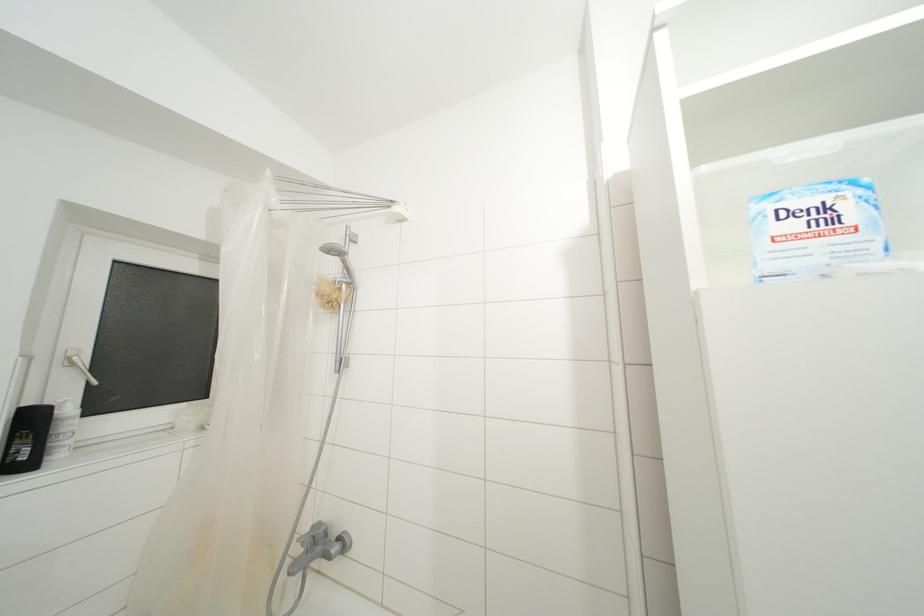
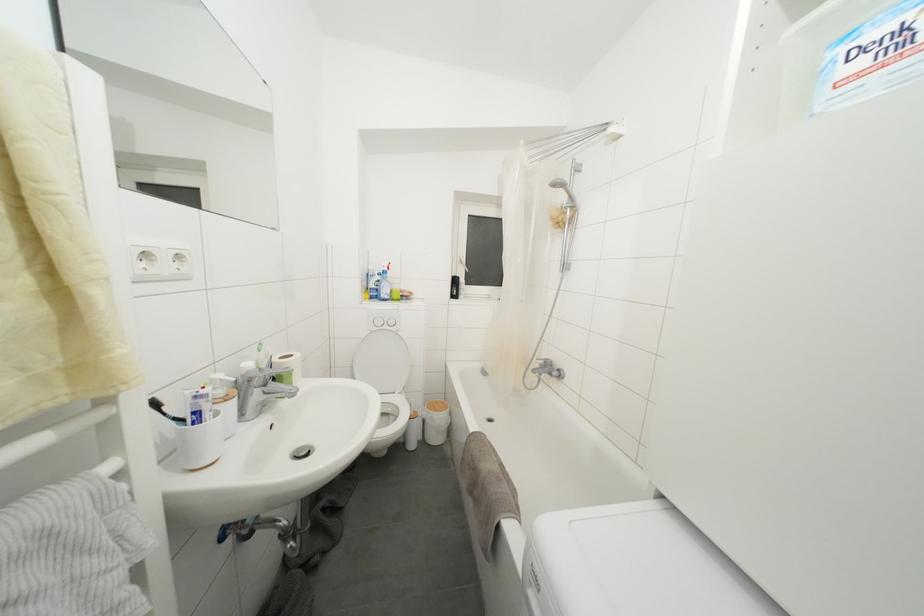
Question: How did the camera likely rotate?

Choices:
 (A) Left
 (B) Right
 (C) Up
 (D) Down

Answer: (A)